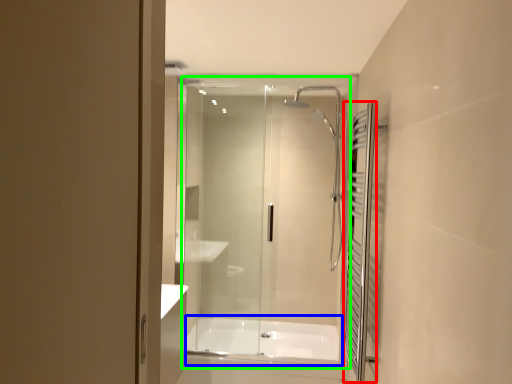
Question: Based on their relative distances, which object is nearer to shower curtain (highlighted by a red box)? Choose from bath (highlighted by a blue box) and glass door (highlighted by a green box).

Choices:
 (A) bath
 (B) glass door

Answer: (B)